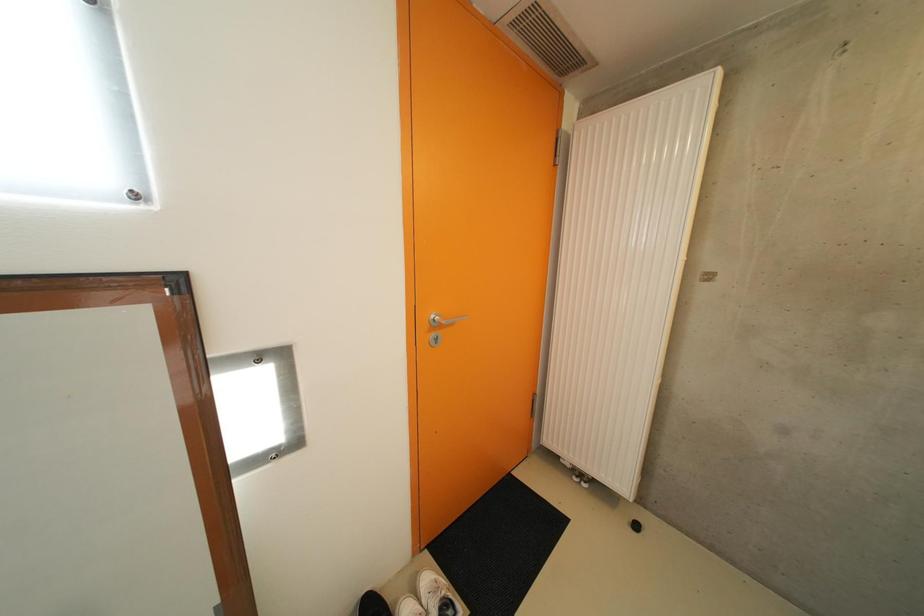
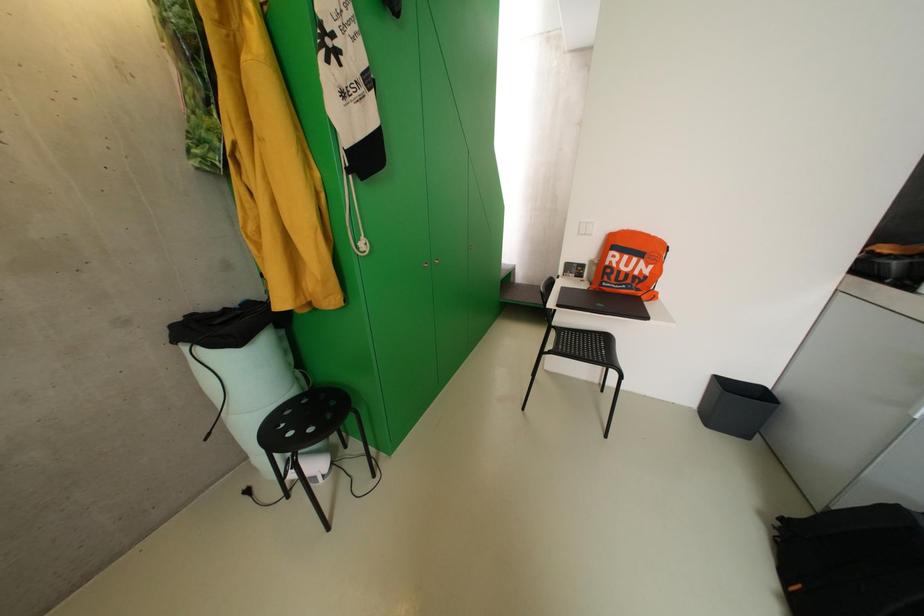
The first image is from the beginning of the video and the second image is from the end. How did the camera likely rotate when shooting the video?

The camera's rotation is toward right-down.